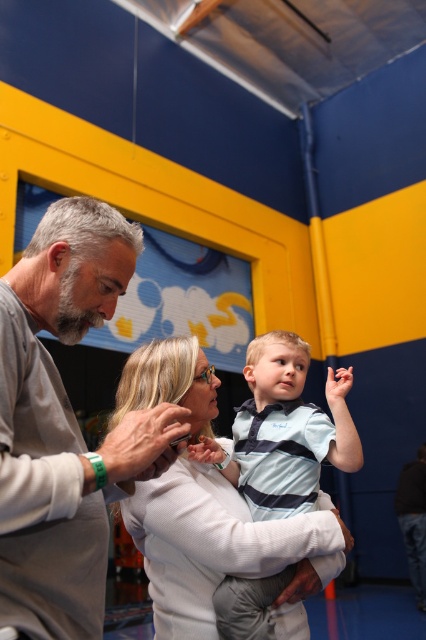
Who is lower down, gray matte shirt at center or white textured shirt at center?

white textured shirt at center is below.

Is gray matte shirt at center shorter than white textured shirt at center?

In fact, gray matte shirt at center may be taller than white textured shirt at center.

Does point (161, 417) come behind point (262, 541)?

No, it is not.

The image size is (426, 640). Find the location of `gray matte shirt at center`. gray matte shirt at center is located at coordinates (65, 424).